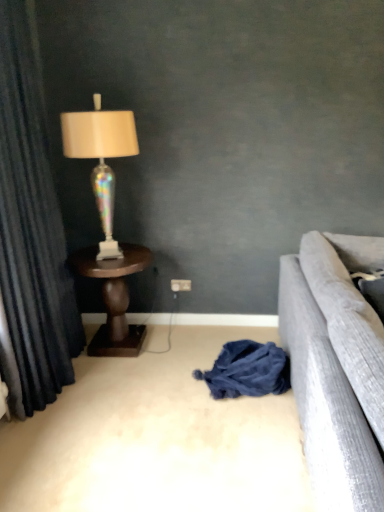
Where is `white plastic power outlet at center`? This screenshot has height=512, width=384. white plastic power outlet at center is located at coordinates (180, 285).

Image resolution: width=384 pixels, height=512 pixels. Describe the element at coordinates (180, 285) in the screenshot. I see `white plastic power outlet at center` at that location.

Measure the distance between brown wooden table at left and camera.

They are 2.58 meters apart.

Measure the distance between point (x=231, y=386) and camera.

Point (x=231, y=386) and camera are 2.40 meters apart.

The image size is (384, 512). Describe the element at coordinates (247, 370) in the screenshot. I see `dark blue fabric at center` at that location.

Image resolution: width=384 pixels, height=512 pixels. Describe the element at coordinates (101, 157) in the screenshot. I see `iridescent glass lamp at left` at that location.

In order to face dark blue velvet curtain at left, should I rotate leftwards or rightwards?

Turn left approximately 20.257 degrees to face it.

Where is `white plastic power outlet at center`? This screenshot has height=512, width=384. white plastic power outlet at center is located at coordinates (180, 285).

Which is more to the right, dark blue fabric at center or iridescent glass lamp at left?

dark blue fabric at center is more to the right.

Is dark blue fabric at center looking in the opposite direction of iridescent glass lamp at left?

No, dark blue fabric at center is not facing away from iridescent glass lamp at left.

Is point (284, 358) farther from camera compared to point (81, 124)?

Yes, point (284, 358) is behind point (81, 124).

Is dark blue fabric at center closer to the viewer compared to iridescent glass lamp at left?

Yes, dark blue fabric at center is closer to the viewer.

Is there a large distance between iridescent glass lamp at left and dark blue fabric at center?

That's right, there is a large distance between iridescent glass lamp at left and dark blue fabric at center.

Looking at this image, how far apart are iridescent glass lamp at left and dark blue fabric at center?

iridescent glass lamp at left and dark blue fabric at center are 1.15 meters apart from each other.

Does iridescent glass lamp at left have a lesser width compared to dark blue fabric at center?

Correct, the width of iridescent glass lamp at left is less than that of dark blue fabric at center.

From a real-world perspective, relative to brown wooden table at left, is dark blue fabric at center vertically above or below?

From a real-world perspective, dark blue fabric at center is physically below brown wooden table at left.

Is dark blue fabric at center turned away from brown wooden table at left?

That's not correct — dark blue fabric at center is not looking away from brown wooden table at left.

From the image's perspective, is dark blue fabric at center located above or below brown wooden table at left?

From the image's perspective, dark blue fabric at center appears below brown wooden table at left.

Is dark blue fabric at center completely or partially outside of brown wooden table at left?

dark blue fabric at center is positioned outside brown wooden table at left.

Is point (30, 79) in front of point (116, 303)?

Yes.

Which object is positioned more to the right, dark blue velvet curtain at left or brown wooden table at left?

From the viewer's perspective, brown wooden table at left appears more on the right side.

Looking at their sizes, would you say dark blue velvet curtain at left is wider or thinner than brown wooden table at left?

dark blue velvet curtain at left is thinner than brown wooden table at left.

Who is taller, brown wooden table at left or iridescent glass lamp at left?

iridescent glass lamp at left.

In order to click on lamp located above the brown wooden table at left (from a real-world perspective) in this screenshot , I will do point(101,157).

From the image's perspective, which is above, brown wooden table at left or iridescent glass lamp at left?

iridescent glass lamp at left is shown above in the image.

From a real-world perspective, is iridescent glass lamp at left physically located above or below dark blue velvet curtain at left?

From a real-world perspective, iridescent glass lamp at left is physically above dark blue velvet curtain at left.

Looking at this image, which is closer to the camera, (121,144) or (0,56)?

The point (0,56) is in front.

In the scene shown: Is dark blue velvet curtain at left at the back of iridescent glass lamp at left?

That's not correct — iridescent glass lamp at left is not looking away from dark blue velvet curtain at left.

From the picture: From the image's perspective, which one is positioned lower, iridescent glass lamp at left or dark blue velvet curtain at left?

dark blue velvet curtain at left.

From the image's perspective, who appears lower, iridescent glass lamp at left or brown wooden table at left?

brown wooden table at left, from the image's perspective.

Is iridescent glass lamp at left oriented away from brown wooden table at left?

That's not correct — iridescent glass lamp at left is not looking away from brown wooden table at left.

From a real-world perspective, relative to brown wooden table at left, is iridescent glass lamp at left vertically above or below?

Clearly, from a real-world perspective, iridescent glass lamp at left is above brown wooden table at left.

Which object is further away from the camera, iridescent glass lamp at left or brown wooden table at left?

brown wooden table at left is further from the camera.

Locate an element on the screen. The image size is (384, 512). lamp behind the dark blue fabric at center is located at coordinates (101, 157).

Identify the location of lamp above the dark blue fabric at center (from a real-world perspective). (101, 157).

Based on their spatial positions, is dark blue velvet curtain at left or iridescent glass lamp at left closer to white plastic power outlet at center?

Based on the image, iridescent glass lamp at left appears to be nearer to white plastic power outlet at center.

From the image, which object appears to be farther from white plastic power outlet at center, dark blue fabric at center or dark blue velvet curtain at left?

dark blue velvet curtain at left lies further to white plastic power outlet at center than the other object.

Considering their positions, is brown wooden table at left positioned closer to dark blue velvet curtain at left than white plastic power outlet at center?

The object closer to dark blue velvet curtain at left is brown wooden table at left.

Considering their positions, is brown wooden table at left positioned closer to dark blue fabric at center than iridescent glass lamp at left?

brown wooden table at left lies closer to dark blue fabric at center than the other object.

From the image, which object appears to be farther from white plastic power outlet at center, brown wooden table at left or iridescent glass lamp at left?

iridescent glass lamp at left.

Estimate the real-world distances between objects in this image. Which object is further from brown wooden table at left, dark blue fabric at center or white plastic power outlet at center?

dark blue fabric at center is further to brown wooden table at left.

From the image, which object appears to be nearer to dark blue fabric at center, iridescent glass lamp at left or white plastic power outlet at center?

white plastic power outlet at center.

Looking at the image, which one is located closer to brown wooden table at left, dark blue velvet curtain at left or dark blue fabric at center?

dark blue velvet curtain at left.

I want to click on table between dark blue fabric at center and white plastic power outlet at center from front to back, so click(114, 298).

Identify the location of lamp between dark blue velvet curtain at left and white plastic power outlet at center from front to back. The width and height of the screenshot is (384, 512). (101, 157).

You are a GUI agent. You are given a task and a screenshot of the screen. Output one action in this format:
    pyautogui.click(x=<x>, y=<y>)
    Task: Click on the table between dark blue velvet curtain at left and dark blue fabric at center
    The width and height of the screenshot is (384, 512).
    Given the screenshot: What is the action you would take?
    pyautogui.click(x=114, y=298)

Where is `table between iridescent glass lamp at left and dark blue fabric at center from top to bottom`? Image resolution: width=384 pixels, height=512 pixels. table between iridescent glass lamp at left and dark blue fabric at center from top to bottom is located at coordinates coord(114,298).